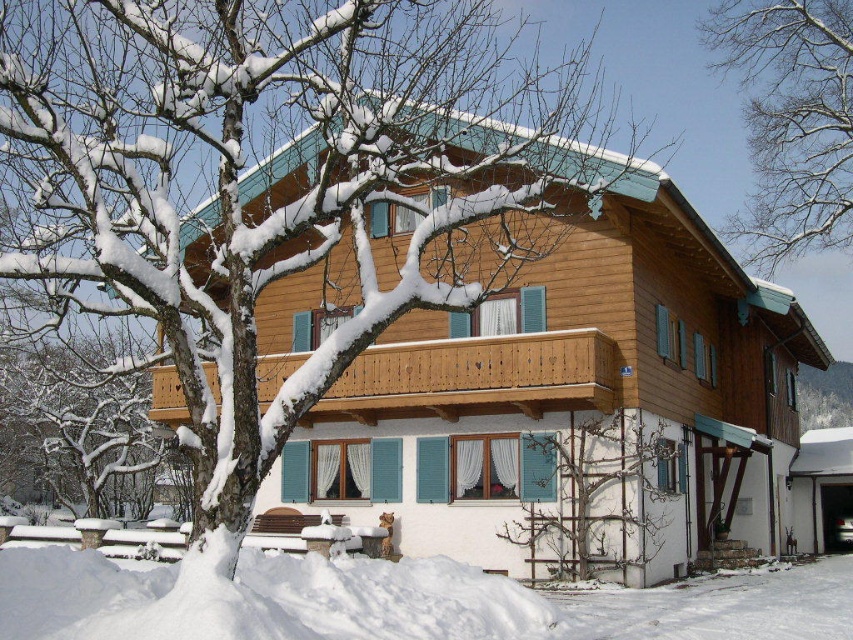
Question: In this image, where is snow-covered wooden tree at upper left located relative to bare wood trellis at lower center?

Choices:
 (A) above
 (B) below

Answer: (A)

Question: Among these objects, which one is farthest from the camera?

Choices:
 (A) bare branches at upper center
 (B) snow-covered wooden tree at upper left

Answer: (A)

Question: Is snow-covered wooden tree at upper left further to camera compared to bare branches at upper center?

Choices:
 (A) yes
 (B) no

Answer: (B)

Question: Which of these objects is positioned closest to the snow-covered wooden tree at upper left?

Choices:
 (A) white fluffy snow at lower left
 (B) bare wood trellis at lower center
 (C) wooden at center

Answer: (C)

Question: Which point is farther from the camera taking this photo?

Choices:
 (A) (42, 465)
 (B) (782, 246)

Answer: (A)

Question: Is bare branches at upper center smaller than wooden at center?

Choices:
 (A) no
 (B) yes

Answer: (A)